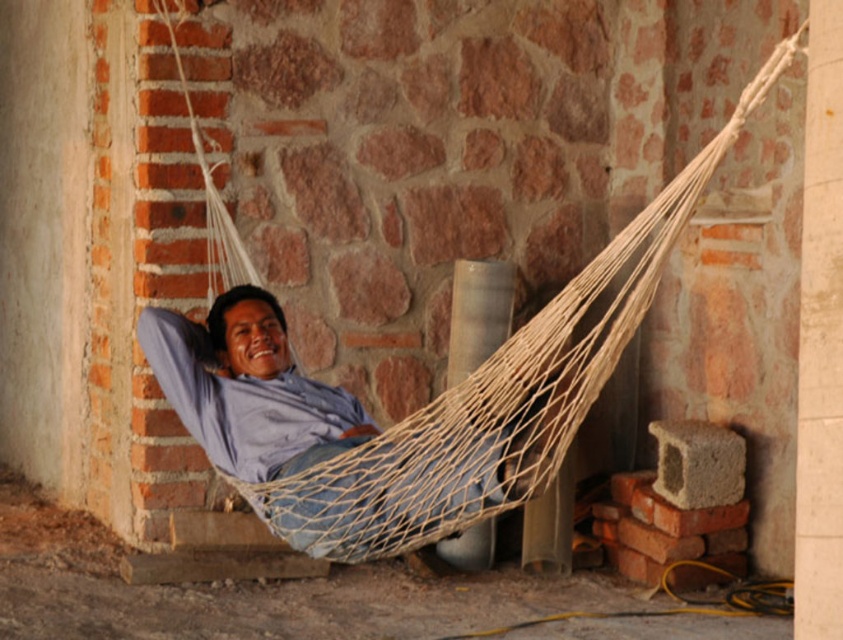
Based on the photo, you are standing 3 meters away from the point marked at coordinates point (280, 483). If you walk straight towards it, will you reach it before it gets closer than 1 meter to you?

The distance of point (280, 483) from viewer is 4.50 meters. Since you are currently 3 meters away, walking towards it will bring you closer. However, the question is whether you can reach it before it gets closer than 1 meter. Since you are already 3 meters away, walking towards it reduces the distance. The point will get closer than 1 meter when you are within 1 meter of it. Therefore, you can reach the point before it gets closer than 1 meter because you can stop at exactly 1 meter or continue to reach

You are planning to hang a new hammock in your backyard and want to ensure it can fit between your existing structures. Given the image, which object between the natural fiber hammock at center and the white concrete pillar at center is larger in size?

The natural fiber hammock at center is bigger than the white concrete pillar at center, so the hammock is larger in size.

You are a photographer trying to capture a portrait of the man in the blue cotton shirt at center. The natural fiber hammock at center is blocking your view. Can you determine if you can adjust your camera angle to see the man without moving the hammock?

The natural fiber hammock at center is taller than blue cotton shirt at center, so the hammock is blocking the view of the man. You may need to adjust your camera angle to a lower position to see the man in the blue cotton shirt at center without moving the hammock.